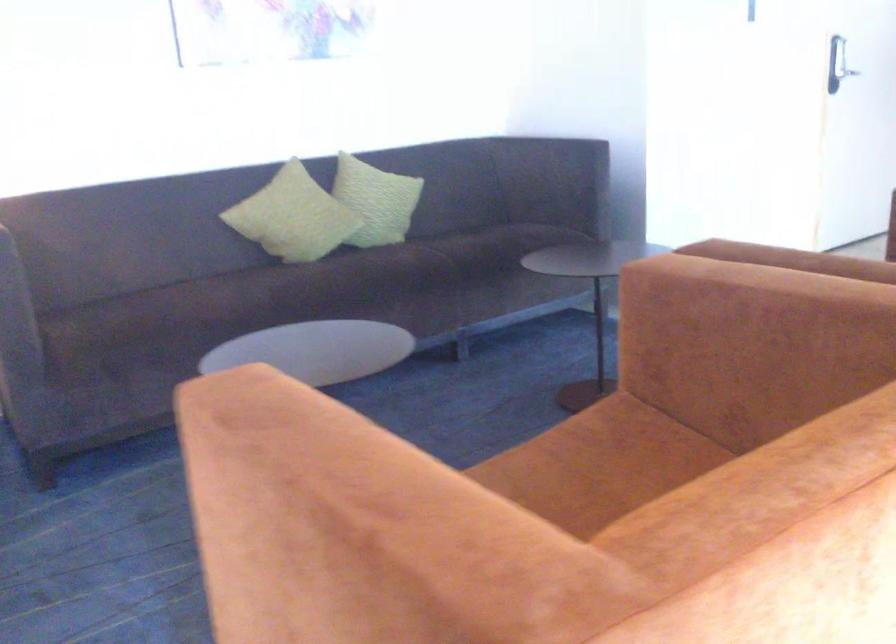
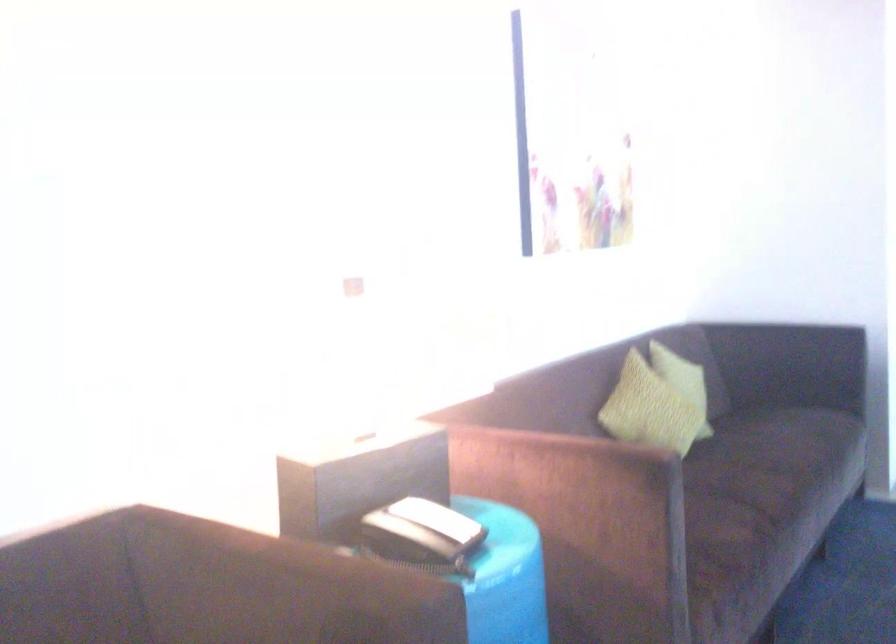
Where in the second image is the point corresponding to the point at 228,220 from the first image?

(648, 410)